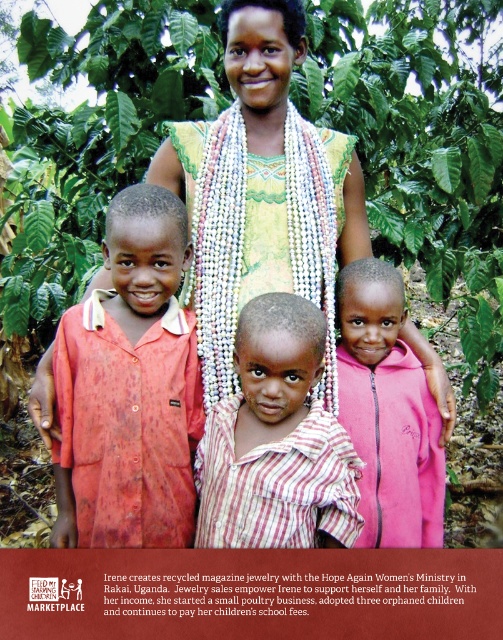
Question: Can you confirm if pink fleece jacket at lower right is positioned below yellow-green woven fabric at center?

Choices:
 (A) yes
 (B) no

Answer: (A)

Question: Which of the following is the farthest from the observer?

Choices:
 (A) (248, 93)
 (B) (267, 474)
 (C) (128, 237)

Answer: (A)

Question: Is pink fleece jacket at lower right to the right of yellow-green woven fabric at center from the viewer's perspective?

Choices:
 (A) no
 (B) yes

Answer: (B)

Question: Is matte red shirt at center bigger than pink fleece jacket at lower right?

Choices:
 (A) yes
 (B) no

Answer: (A)

Question: Which of the following is the closest to the observer?

Choices:
 (A) (279, 83)
 (B) (397, 525)
 (C) (142, 308)

Answer: (C)

Question: Among these points, which one is farthest from the camera?

Choices:
 (A) click(x=280, y=481)
 (B) click(x=255, y=90)

Answer: (B)